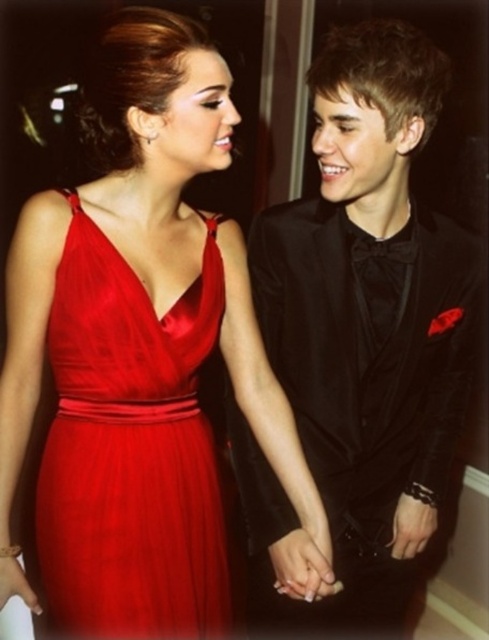
Who is shorter, satin dress at center or black satin suit at center?

With less height is satin dress at center.

Which is in front, point (65, 330) or point (394, 308)?

Point (65, 330) is in front.

Identify the location of satin dress at center. (136, 352).

The image size is (489, 640). In order to click on black satin suit at center in this screenshot , I will do `click(360, 339)`.

Who is more distant from viewer, (338,472) or (71,248)?

Point (338,472)

Locate an element on the screen. The height and width of the screenshot is (640, 489). black satin suit at center is located at coordinates (360, 339).

Does satin dress at center have a larger size compared to satin red dress at center?

Indeed, satin dress at center has a larger size compared to satin red dress at center.

Does point (120, 164) come closer to viewer compared to point (163, 579)?

No.

Is point (311, 500) positioned in front of point (108, 541)?

No, it is not.

This screenshot has width=489, height=640. I want to click on satin dress at center, so click(136, 352).